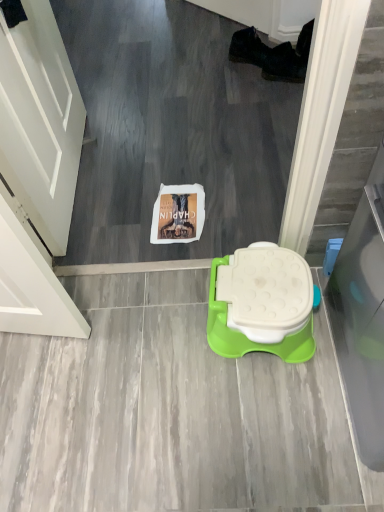
The width and height of the screenshot is (384, 512). Find the location of `free spot behind white matte door at upper left`. free spot behind white matte door at upper left is located at coordinates (116, 99).